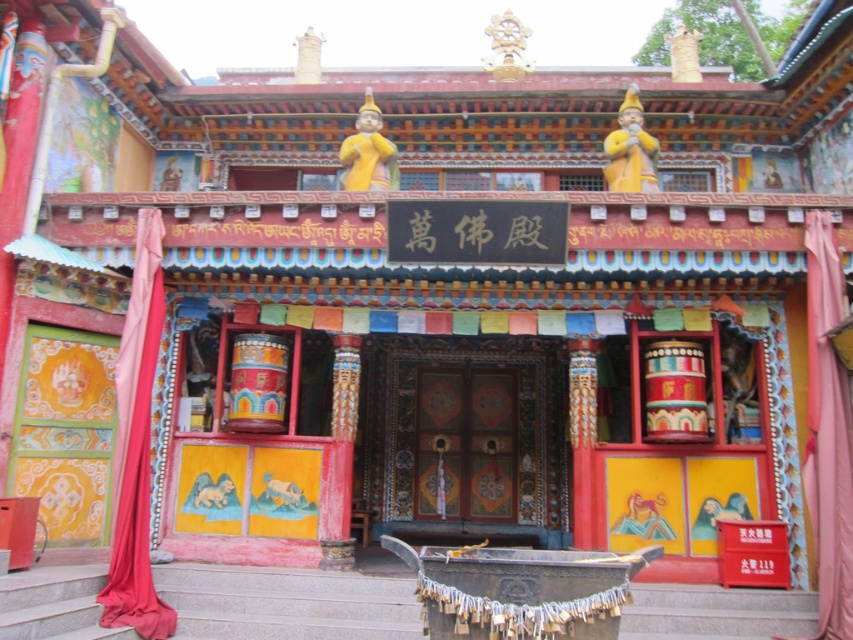
Is point (412, 371) behind point (822, 396)?

That is True.

In the scene shown: Is painted wood door at center below pink fabric curtain at right?

No.

Between point (415, 474) and point (825, 342), which one is positioned behind?

Point (415, 474)

The height and width of the screenshot is (640, 853). I want to click on painted wood door at center, so click(x=468, y=438).

What do you see at coordinates (827, 433) in the screenshot? I see `pink fabric curtain at right` at bounding box center [827, 433].

Between pink fabric curtain at right and red fabric curtain at left, which one is positioned lower?

pink fabric curtain at right is below.

This screenshot has width=853, height=640. What are the coordinates of `pink fabric curtain at right` in the screenshot? It's located at (827, 433).

Locate an element on the screen. Image resolution: width=853 pixels, height=640 pixels. pink fabric curtain at right is located at coordinates (827, 433).

Consider the image. Is painted wood door at center closer to camera compared to red fabric curtain at left?

No, it is not.

Does painted wood door at center appear on the left side of red fabric curtain at left?

No, painted wood door at center is not to the left of red fabric curtain at left.

Does point (498, 365) lie behind point (144, 608)?

Yes, point (498, 365) is behind point (144, 608).

Find the location of a particular element. painted wood door at center is located at coordinates (468, 438).